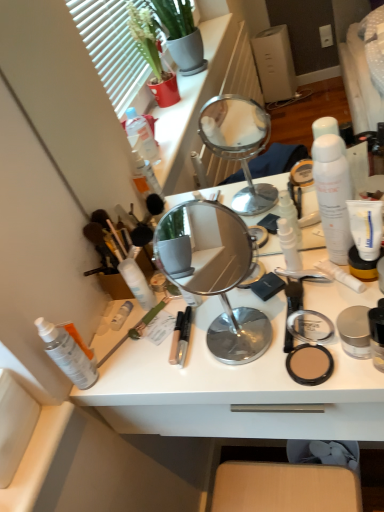
The image size is (384, 512). In order to click on vacant region to the left of white matte tube at right, the first toothpaste when ordered from bottom to top in this screenshot , I will do `click(269, 318)`.